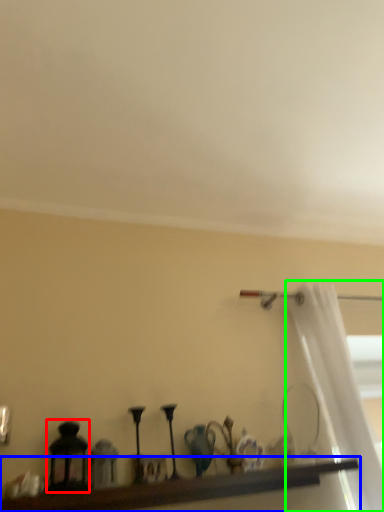
Question: Which object is the closest to the candle holder (highlighted by a red box)? Choose among these: shelf (highlighted by a blue box) or curtain (highlighted by a green box).

Choices:
 (A) shelf
 (B) curtain

Answer: (A)